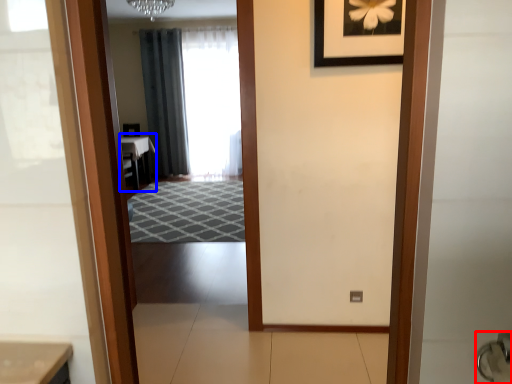
Question: Among these objects, which one is farthest to the camera, door handle (highlighted by a red box) or table (highlighted by a blue box)?

Choices:
 (A) door handle
 (B) table

Answer: (B)